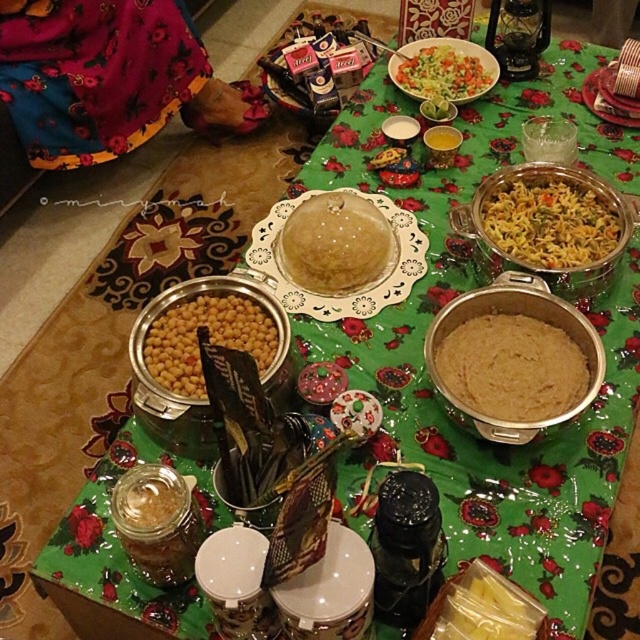
You are sitting at the festive table and want to reach for a dish. You notice two points on the table. Which point is closer to you, point at coordinates (188, 358) or point at coordinates (436, 45)?

Point at coordinates (188, 358) is in front of point at coordinates (436, 45), so it is closer to you.

You are a guest at a festive meal and want to locate the yellow matte chickpeas at center. According to the table layout, where exactly would you find them?

The yellow matte chickpeas at center are located at the coordinates point (x=205, y=339) on the table.

You are sitting at the table and want to reach for the brown matte rice at center and the green leafy salad at center. Which one can you grab first without moving your hand?

The brown matte rice at center is closer to the viewer than the green leafy salad at center, so you can grab it first without moving your hand.